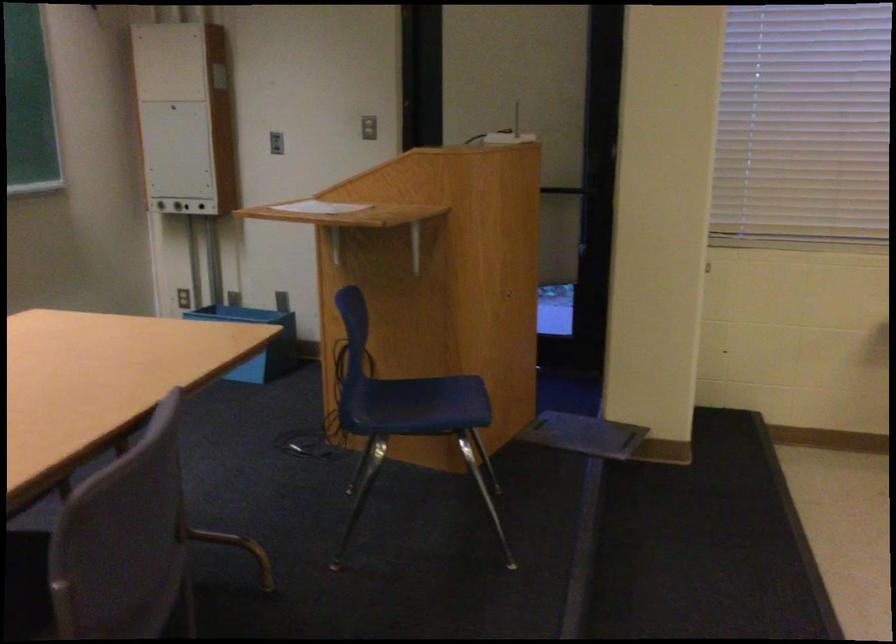
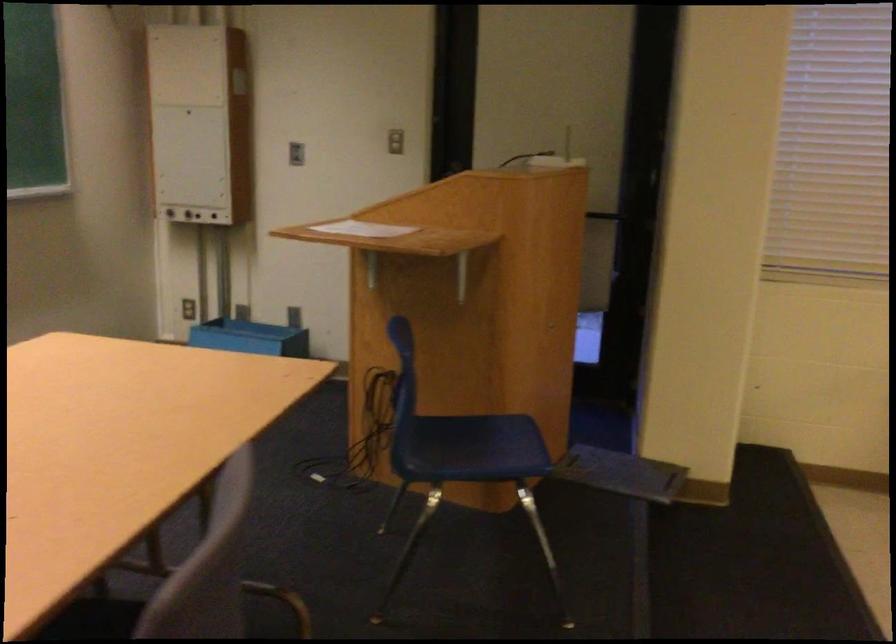
The images are taken continuously from a first-person perspective. In which direction are you moving?

The cameraman moved toward left, forward.